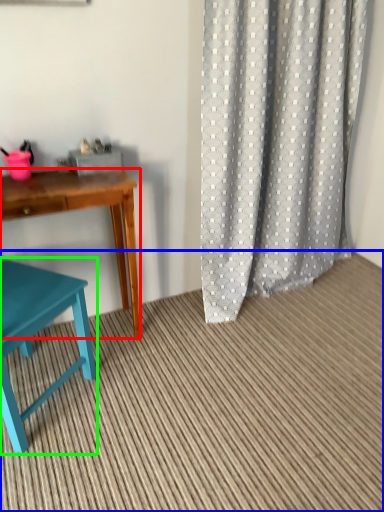
Question: Estimate the real-world distances between objects in this image. Which object is closer to desk (highlighted by a red box), plain (highlighted by a blue box) or chair (highlighted by a green box)?

Choices:
 (A) plain
 (B) chair

Answer: (B)